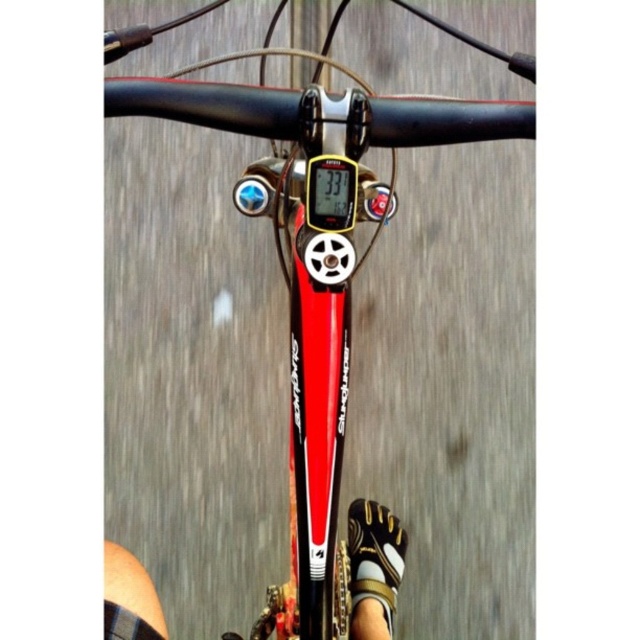
Question: Can you confirm if shiny metallic bicycle at center is wider than white textured shoe at lower center?

Choices:
 (A) yes
 (B) no

Answer: (A)

Question: Is white textured shoe at lower center thinner than white textured sandal at lower center?

Choices:
 (A) yes
 (B) no

Answer: (B)

Question: Which of the following is the closest to the observer?

Choices:
 (A) white textured sandal at lower center
 (B) white textured shoe at lower center
 (C) shiny metallic bicycle at center

Answer: (C)

Question: Which object is closer to the camera taking this photo?

Choices:
 (A) shiny metallic bicycle at center
 (B) white textured shoe at lower center

Answer: (A)

Question: Observing the image, what is the correct spatial positioning of shiny metallic bicycle at center in reference to white textured shoe at lower center?

Choices:
 (A) above
 (B) below

Answer: (A)

Question: Estimate the real-world distances between objects in this image. Which object is closer to the shiny metallic bicycle at center?

Choices:
 (A) white textured shoe at lower center
 (B) white textured sandal at lower center

Answer: (A)